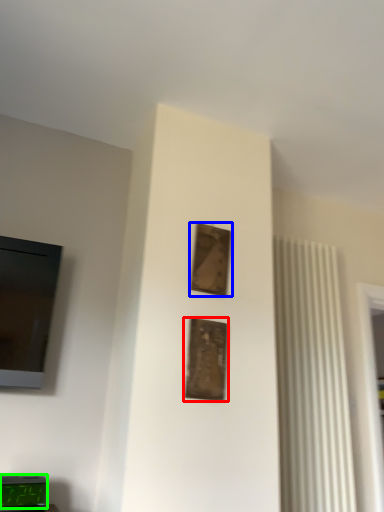
Question: Estimate the real-world distances between objects in this image. Which object is farther from picture frame (highlighted by a red box), picture frame (highlighted by a blue box) or alarm clock (highlighted by a green box)?

Choices:
 (A) picture frame
 (B) alarm clock

Answer: (B)